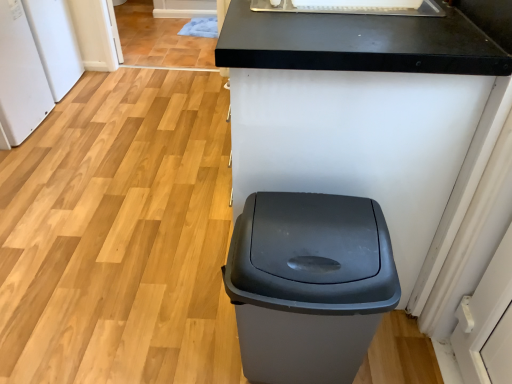
At what (x,y) coordinates should I click in order to perform the action: click on free space above matte gray plastic trash can at center (from a real-world perspective). Please return your answer as a coordinate pair (x, y). This screenshot has height=384, width=512. Looking at the image, I should click on (313, 217).